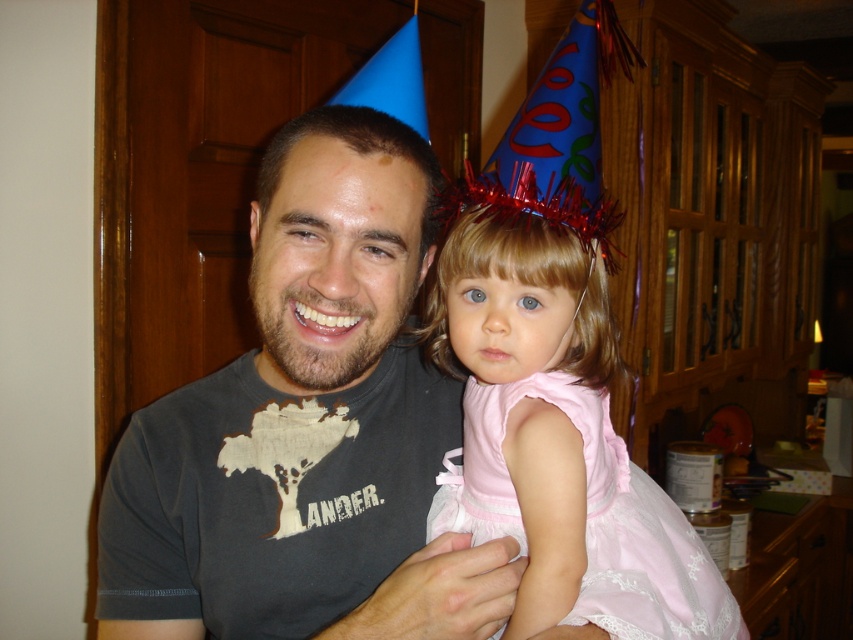
Question: In this image, where is dark gray t-shirt at center located relative to pink satin dress at center?

Choices:
 (A) right
 (B) left

Answer: (B)

Question: Is dark gray t-shirt at center positioned at the back of pink satin dress at center?

Choices:
 (A) no
 (B) yes

Answer: (A)

Question: Can you confirm if dark gray t-shirt at center is thinner than pink satin dress at center?

Choices:
 (A) yes
 (B) no

Answer: (B)

Question: Which of the following is the farthest from the observer?

Choices:
 (A) (251, 508)
 (B) (498, 520)

Answer: (B)

Question: Which of the following is the closest to the observer?

Choices:
 (A) (407, 177)
 (B) (496, 458)

Answer: (A)

Question: Which of the following is the farthest from the observer?

Choices:
 (A) pink satin dress at center
 (B) dark gray t-shirt at center

Answer: (A)